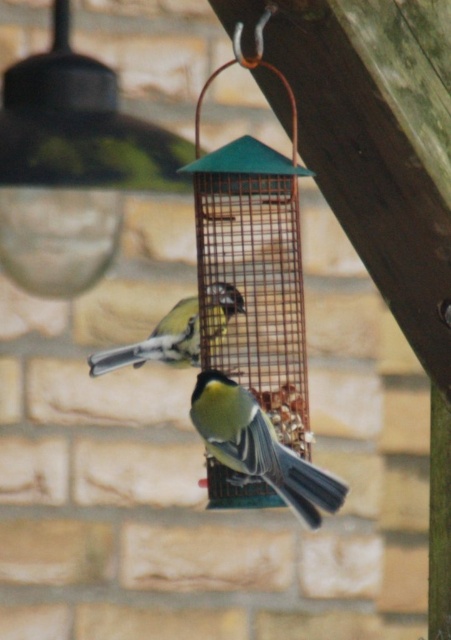
Question: Does green matte bird at center lie in front of yellow-green feathers at center?

Choices:
 (A) yes
 (B) no

Answer: (A)

Question: Which of these objects is positioned farthest from the green mesh bird feeder at center?

Choices:
 (A) yellow-green feathers at center
 (B) green matte bird at center

Answer: (B)

Question: Is green mesh bird feeder at center below yellow-green feathers at center?

Choices:
 (A) yes
 (B) no

Answer: (B)

Question: Which object is closer to the camera taking this photo?

Choices:
 (A) yellow-green feathers at center
 (B) green matte bird at center
 (C) green mesh bird feeder at center

Answer: (B)

Question: Which point is farther from the camera taking this photo?

Choices:
 (A) (194, 317)
 (B) (253, 433)

Answer: (A)

Question: Observing the image, what is the correct spatial positioning of green mesh bird feeder at center in reference to green matte bird at center?

Choices:
 (A) left
 (B) right

Answer: (A)